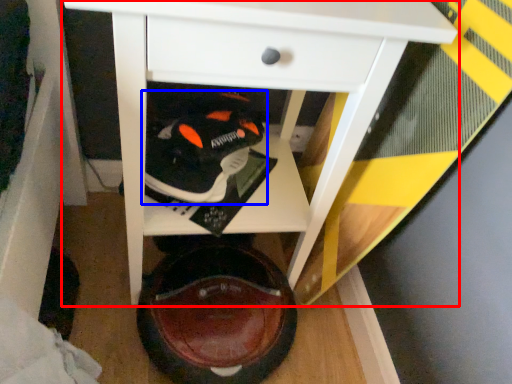
Question: Among these objects, which one is farthest to the camera, table (highlighted by a red box) or footwear (highlighted by a blue box)?

Choices:
 (A) table
 (B) footwear

Answer: (B)